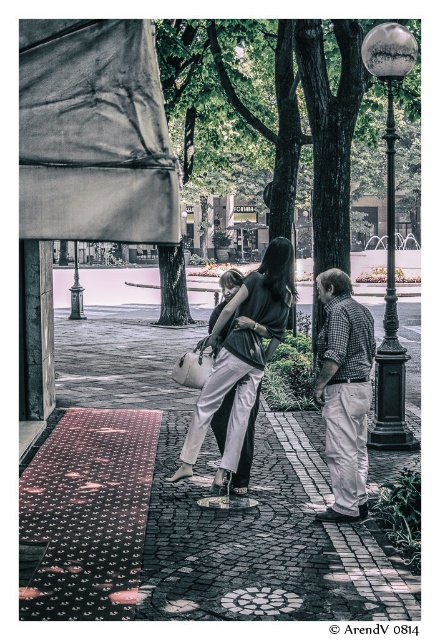
You are a photographer setting up a tripod in the plaza. You need to position it so that both the polished stone pavement at center and the matte gray fabric canopy at upper left are visible in the frame. Which object should you place closer to the camera to ensure both are in focus?

The polished stone pavement at center should be placed closer to the camera because it is much taller than the matte gray fabric canopy at upper left, allowing both to be in focus when the closer object is centered.